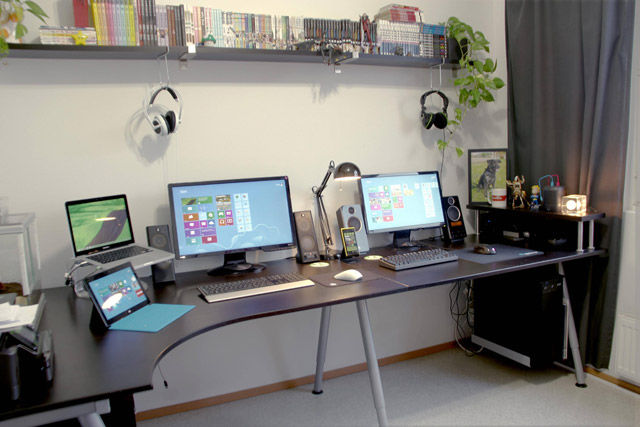
This screenshot has width=640, height=427. What are the coordinates of `desktop` in the screenshot? It's located at (246, 208), (415, 204).